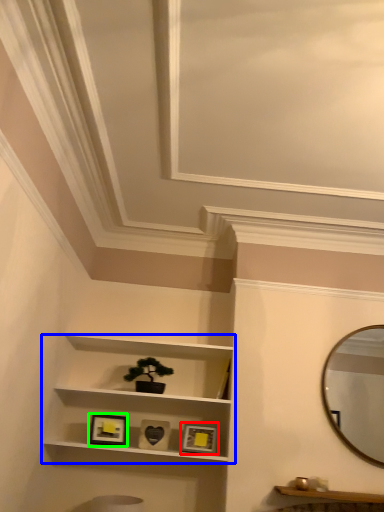
Question: Estimate the real-world distances between objects in this image. Which object is closer to picture frame (highlighted by a red box), shelf (highlighted by a blue box) or picture frame (highlighted by a green box)?

Choices:
 (A) shelf
 (B) picture frame

Answer: (A)